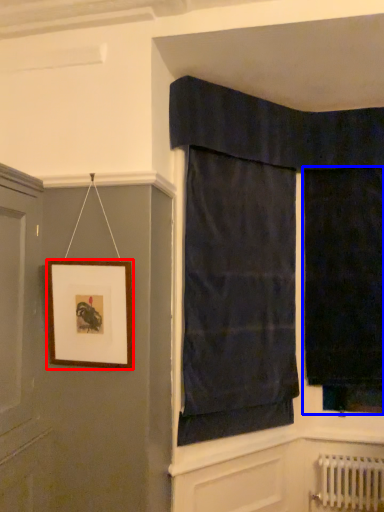
Question: Which of the following is the farthest to the observer, picture frame (highlighted by a red box) or curtain (highlighted by a blue box)?

Choices:
 (A) picture frame
 (B) curtain

Answer: (B)